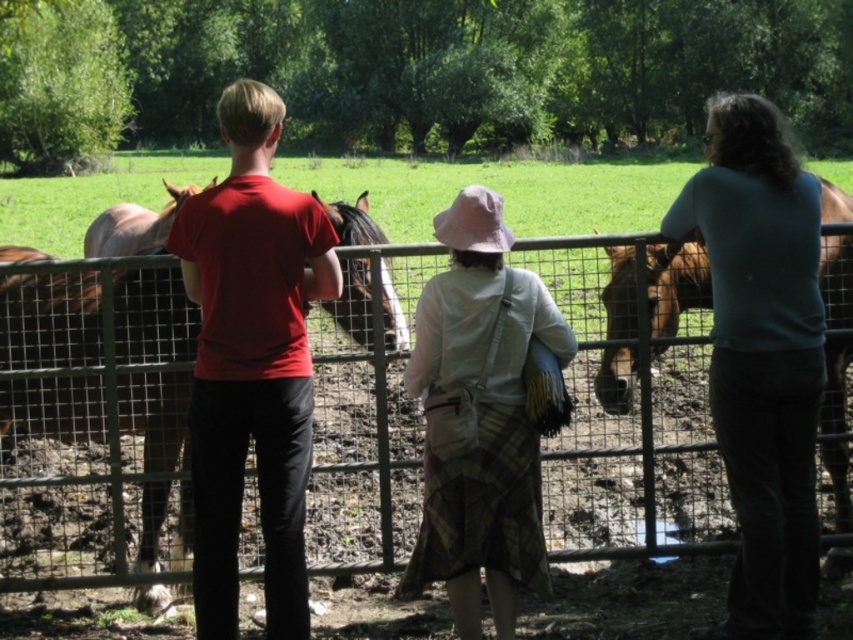
You are standing at the center of the scene and want to locate the plaid fabric skirt at center. Based on the coordinates provided, in which direction should you look to find it?

The plaid fabric skirt at center is located at coordinates point (479, 419), so you should look to the right and slightly downward from the center to find it.